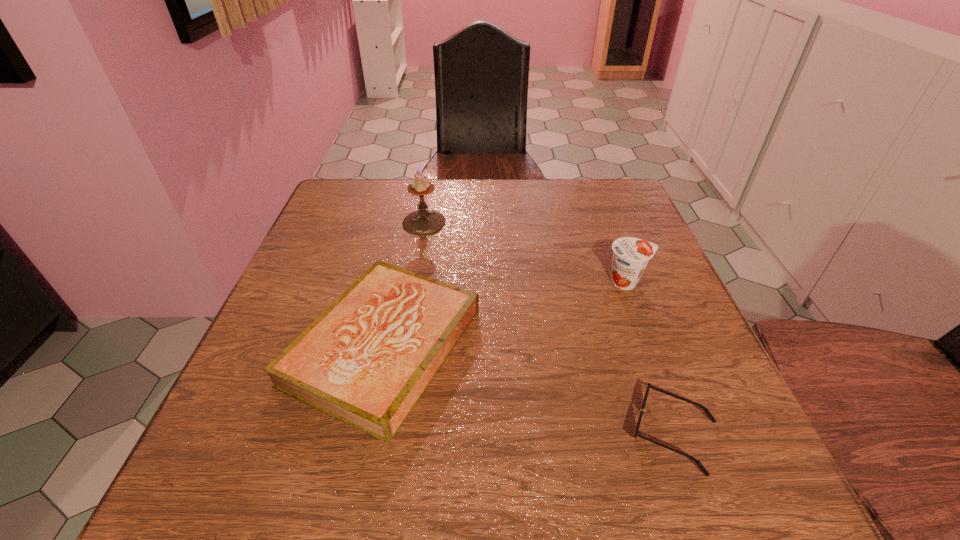
Locate an element on the screen. free region at the right edge is located at coordinates (643, 228).

What are the coordinates of `vacant space at the far left corner of the desktop` in the screenshot? It's located at (352, 181).

Find the location of a particular element. The height and width of the screenshot is (540, 960). vacant space at the near left corner of the desktop is located at coordinates (201, 489).

Where is `vacant space at the far right corner of the desktop`? This screenshot has width=960, height=540. vacant space at the far right corner of the desktop is located at coordinates (623, 202).

This screenshot has width=960, height=540. Find the location of `free spot between the shortest object and the hardback book`. free spot between the shortest object and the hardback book is located at coordinates (528, 389).

This screenshot has width=960, height=540. I want to click on empty space between the shortest object and the hardback book, so click(528, 389).

The width and height of the screenshot is (960, 540). I want to click on unoccupied position between the candle holder and the second tallest object, so click(525, 252).

Find the location of a particular element. This screenshot has width=960, height=540. vacant space that's between the farthest object and the yogurt is located at coordinates (525, 252).

Find the location of a particular element. Image resolution: width=960 pixels, height=540 pixels. blank region between the hardback book and the sunglasses is located at coordinates (528, 389).

Find the location of a particular element. vacant area between the yogurt and the hardback book is located at coordinates (505, 314).